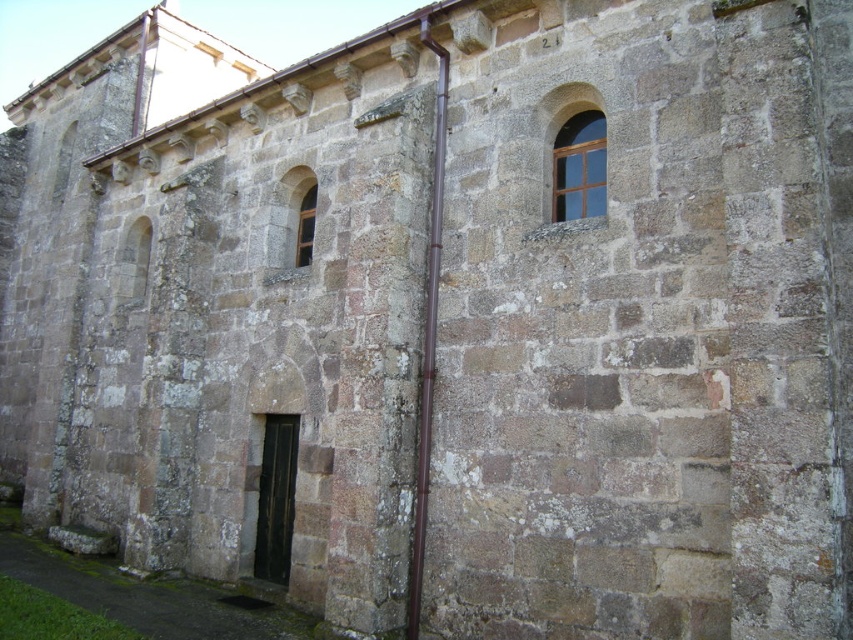
Between clear glass window at upper center and matte stone window at center, which one appears on the left side from the viewer's perspective?

Positioned to the left is matte stone window at center.

Is clear glass window at upper center positioned behind matte stone window at center?

No, it is not.

The height and width of the screenshot is (640, 853). I want to click on clear glass window at upper center, so click(579, 168).